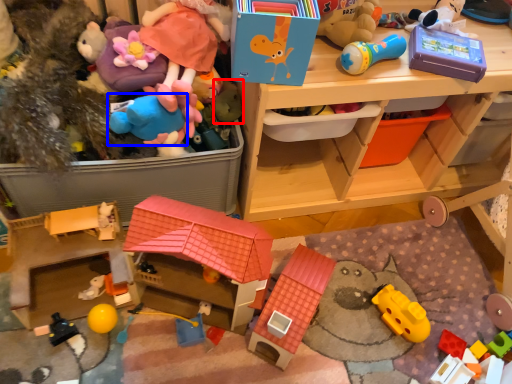
Question: Which point is closer to the camera, toy (highlighted by a red box) or toy (highlighted by a blue box)?

Choices:
 (A) toy
 (B) toy

Answer: (B)